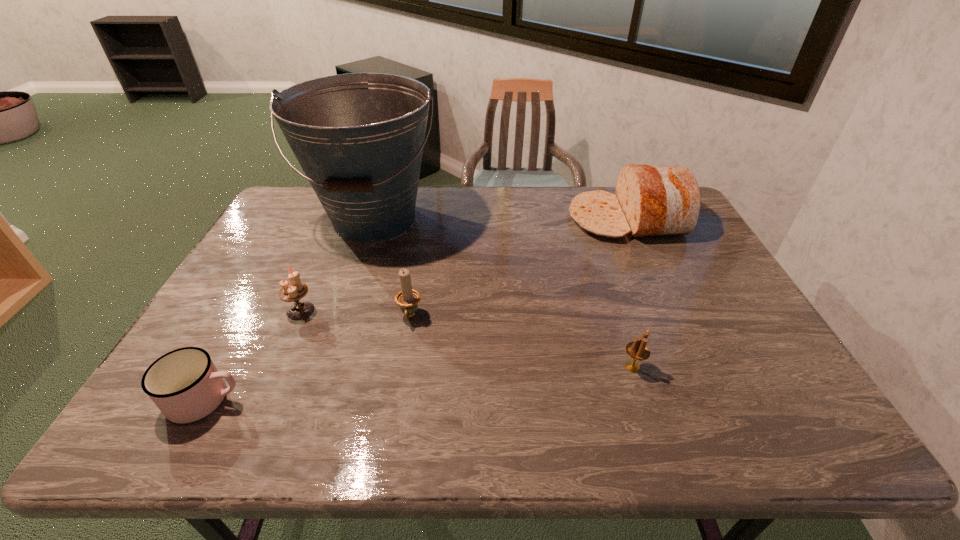
Find the location of a particular element. the tallest object is located at coordinates (359, 137).

You are a GUI agent. You are given a task and a screenshot of the screen. Output one action in this format:
    pyautogui.click(x=<x>, y=<y>)
    Task: Click on the bread
    
    Given the screenshot: What is the action you would take?
    tap(651, 200)

At what (x,y) coordinates should I click in order to perform the action: click on the second candle holder from right to left. Please return your answer as a coordinate pair (x, y). Looking at the image, I should click on (408, 298).

Locate an element on the screen. the leftmost candle holder is located at coordinates (293, 292).

You are a GUI agent. You are given a task and a screenshot of the screen. Output one action in this format:
    pyautogui.click(x=<x>, y=<y>)
    Task: Click on the nearest candle holder
    
    Given the screenshot: What is the action you would take?
    [637, 350]

Locate an element on the screen. mug is located at coordinates click(x=185, y=385).

Identify the location of vacant space situated 0.250m with the handle on opposite sides of the bucket. This screenshot has width=960, height=540. (343, 319).

Where is `vacant space located at the sliced end of the bread`? vacant space located at the sliced end of the bread is located at coordinates point(511,219).

Image resolution: width=960 pixels, height=540 pixels. In order to click on free space located at the sliced end of the bread in this screenshot , I will do `click(508, 219)`.

At what (x,y) coordinates should I click in order to perform the action: click on vacant space located 0.400m at the sliced end of the bread. Please return your answer as a coordinate pair (x, y). The width and height of the screenshot is (960, 540). Looking at the image, I should click on (453, 219).